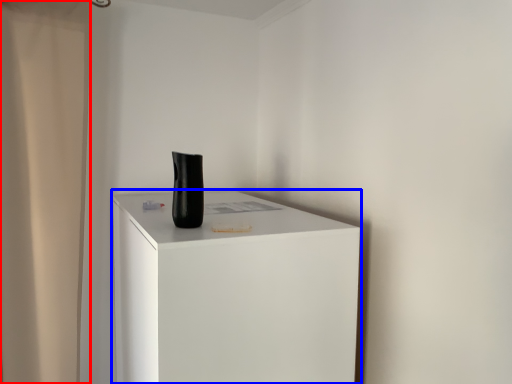
Question: Which object appears closest to the camera in this image, shower curtain (highlighted by a red box) or furniture (highlighted by a blue box)?

Choices:
 (A) shower curtain
 (B) furniture

Answer: (B)